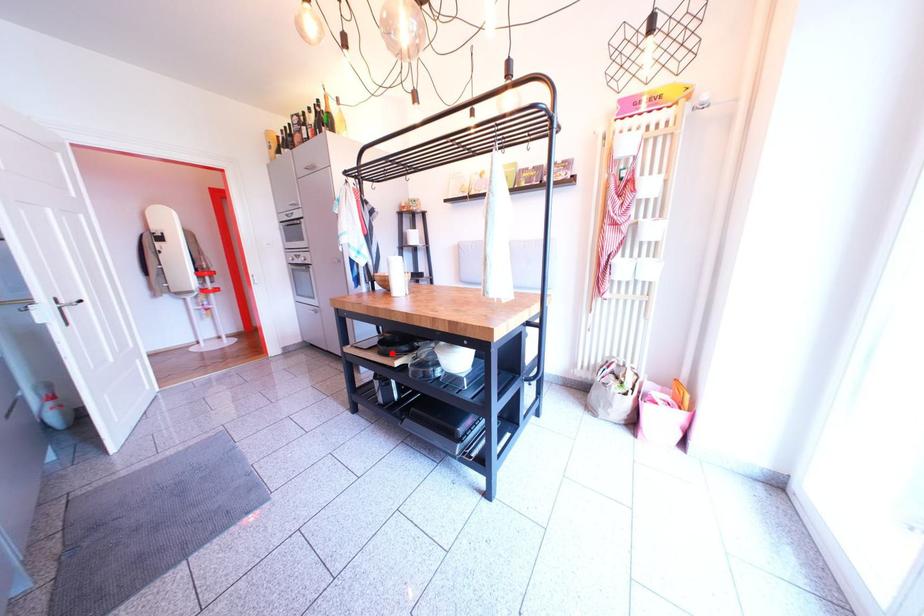
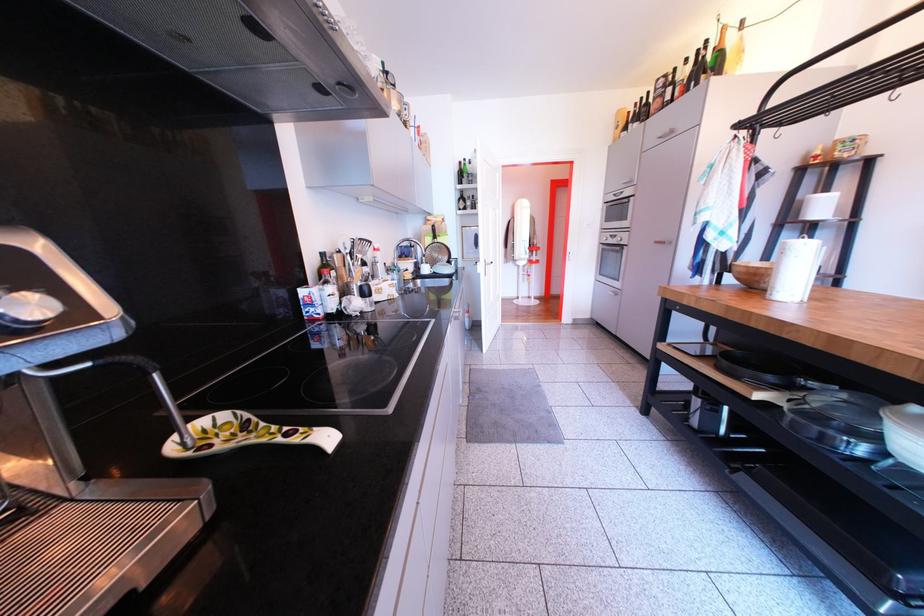
Where in the second image is the point corresponding to the highlighted location from the first image?

(736, 369)